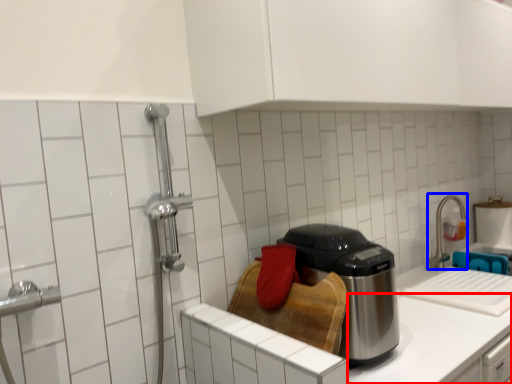
Question: Which point is closer to the camera, counter top (highlighted by a red box) or faucet (highlighted by a blue box)?

Choices:
 (A) counter top
 (B) faucet

Answer: (A)